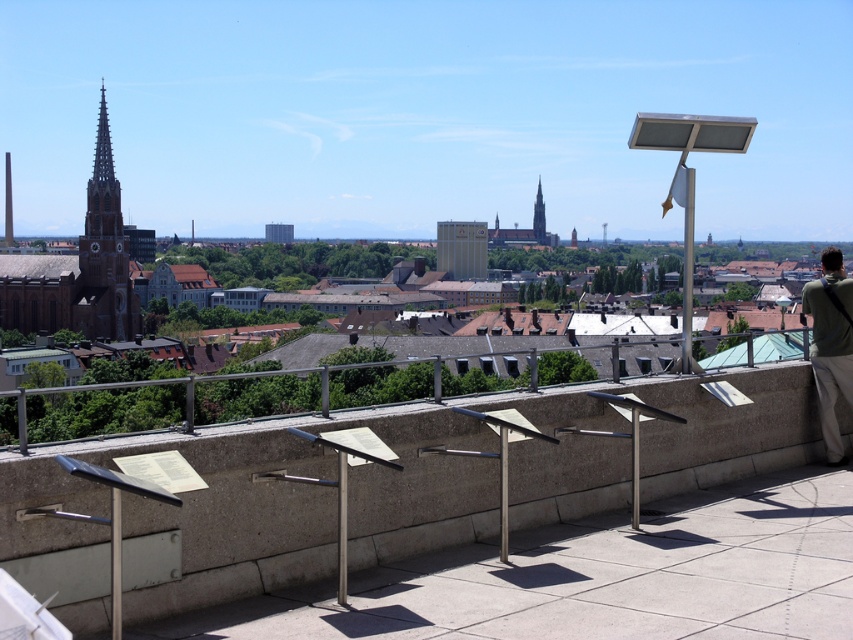
From the picture: You are standing on an observation deck and want to place a green fabric bag at right on top of the concrete at center. Will the bag be visible from below the concrete?

The concrete at center is shorter than the green fabric bag at right. Since the concrete is shorter, the bag placed on top would extend above it, making the bag visible from below the concrete.

You are standing on the observation deck and want to take a photo of both the church spire and a distant landmark. The church spire is located at point (x=682, y=440), and the distant landmark is at point (x=80, y=276). Which point should you focus on first to ensure both are in the frame?

You should focus on point (x=682, y=440) first because it is closer to the camera than point (x=80, y=276), allowing both to be in the frame when adjusting the zoom.